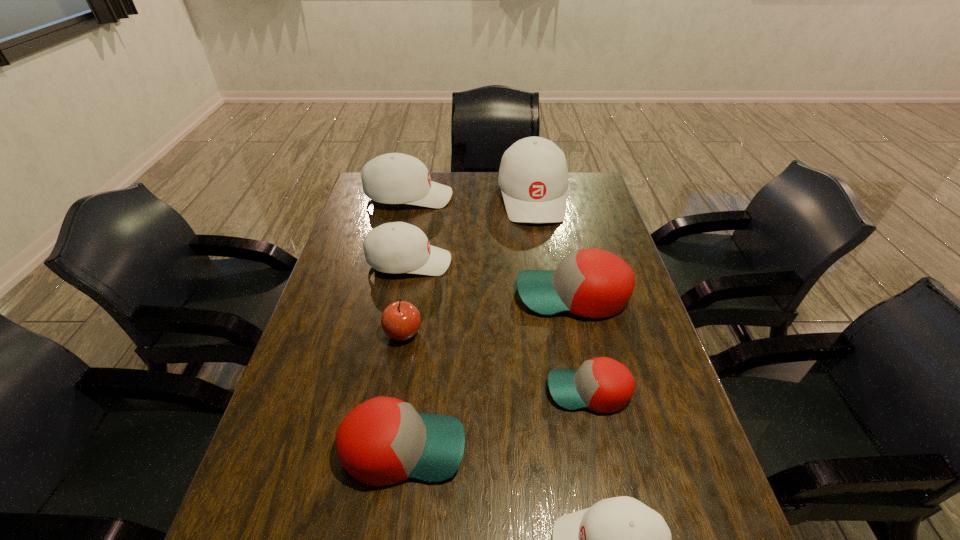
Identify the location of vacant space situated at the brim of the shortest baseball cap. (453, 391).

You are a GUI agent. You are given a task and a screenshot of the screen. Output one action in this format:
    pyautogui.click(x=<x>, y=<y>)
    Task: Click on the object present at the far left corner
    The width and height of the screenshot is (960, 540).
    Given the screenshot: What is the action you would take?
    pyautogui.click(x=394, y=178)

At what (x,y) coordinates should I click in order to perform the action: click on object situated at the far right corner. Please return your answer as a coordinate pair (x, y). Looking at the image, I should click on (533, 176).

At what (x,y) coordinates should I click in order to perform the action: click on free space at the far edge of the desktop. Please return your answer as a coordinate pair (x, y). This screenshot has height=540, width=960. Looking at the image, I should click on (475, 194).

Where is `vacant space at the left edge of the desktop`? vacant space at the left edge of the desktop is located at coordinates (348, 225).

Locate an element on the screen. The height and width of the screenshot is (540, 960). vacant space at the right edge of the desktop is located at coordinates (639, 360).

Where is `unoccupied area between the second biggest white baseball cap and the shortest baseball cap`? The width and height of the screenshot is (960, 540). unoccupied area between the second biggest white baseball cap and the shortest baseball cap is located at coordinates (499, 294).

Identify the location of vacant area that lies between the shortest object and the second nearest white baseball cap. The image size is (960, 540). (499, 327).

At what (x,y) coordinates should I click in order to perform the action: click on vacant region between the tallest object and the third smallest white baseball cap. Please return your answer as a coordinate pair (x, y). The image size is (960, 540). Looking at the image, I should click on (470, 197).

Locate an element on the screen. The width and height of the screenshot is (960, 540). unoccupied area between the apple and the leftmost red baseball cap is located at coordinates (403, 390).